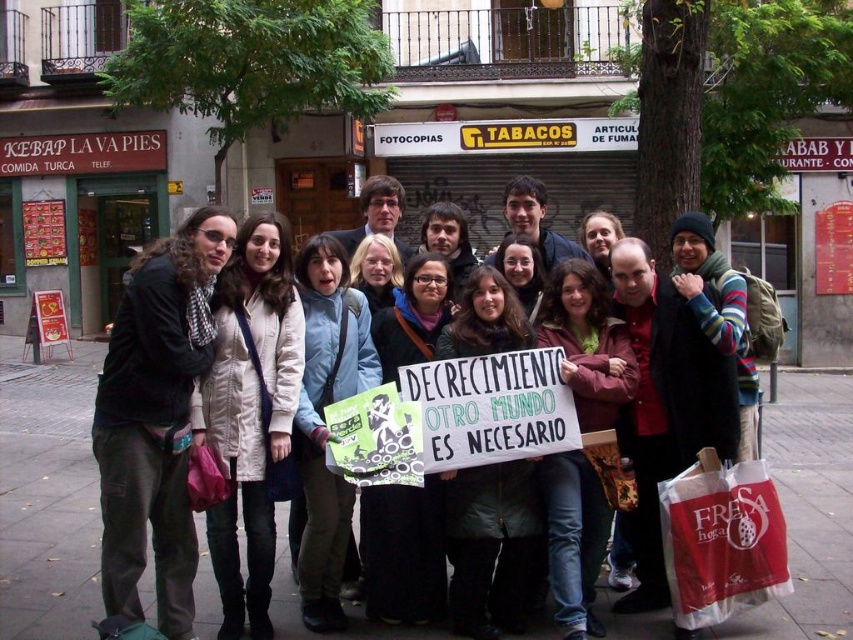
You are a photographer trying to capture a clear shot of the red plastic bag at lower right without the matte black jacket at center blocking it. What adjustment should you make to your camera angle?

The matte black jacket at center is positioned over the red plastic bag at lower right, so to avoid blocking the bag, you should lower your camera angle to shoot from below the jacket.

You are a photographer standing 10 feet away from the group holding a camera with a 50mm lens. You want to capture a photo that includes both the matte black jacket at center and the red plastic bag at lower right without any distortion. Can you fit both objects in the frame at this distance?

The matte black jacket at center is 24.40 inches from the red plastic bag at lower right. At 10 feet away with a 50mm lens, the field of view is approximately 16.6 feet wide. Since 24.40 inches is less than 16.6 feet, both objects can fit within the frame without distortion.

You are a photographer trying to capture a closeup of the banner while ensuring both the matte black jacket at center and the red plastic bag at lower right are visible in the frame. Given their sizes, which object would require you to adjust your camera angle more to keep both in the shot?

The matte black jacket at center has a larger size compared to the red plastic bag at lower right, so the photographer would need to adjust their camera angle more to accommodate the larger size of the matte black jacket at center while keeping both objects visible.